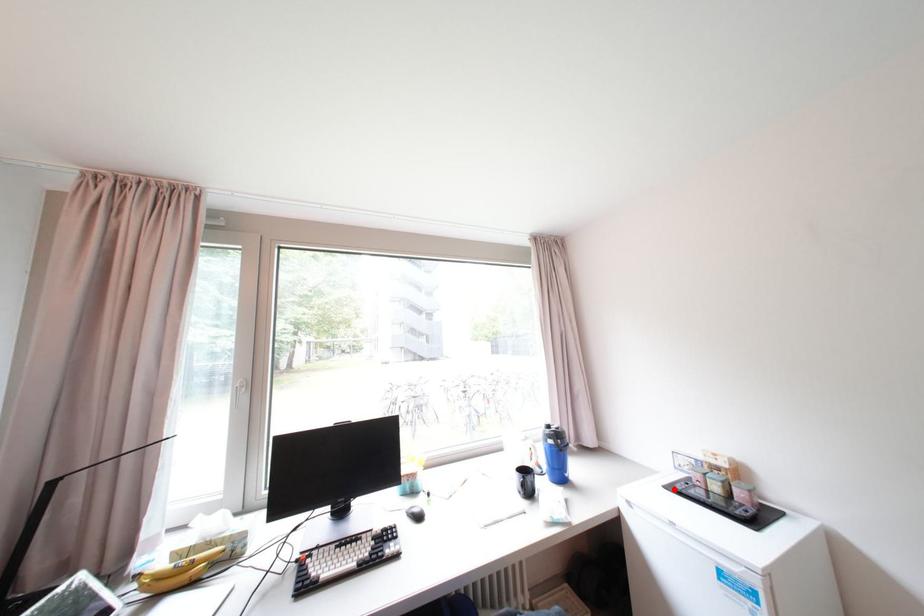
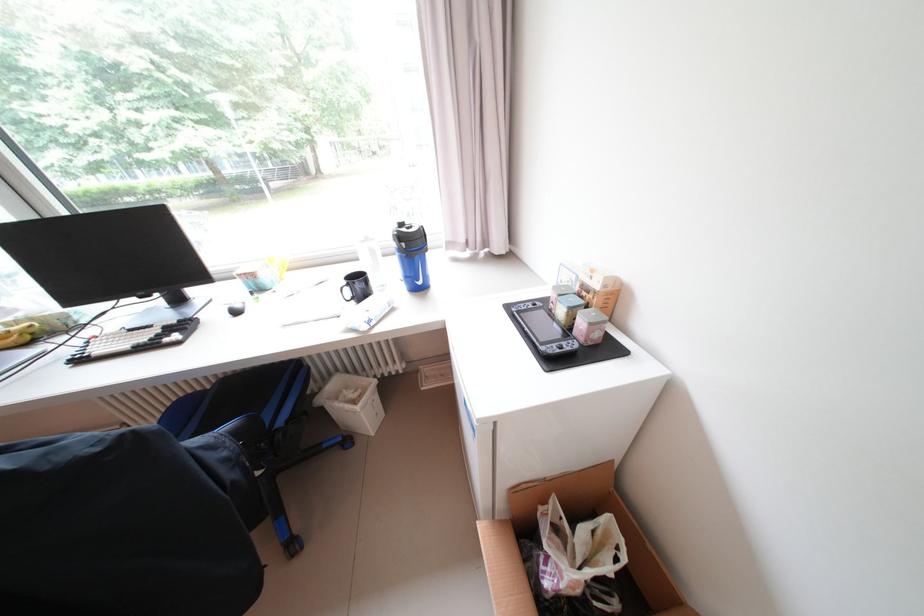
In the second image, find the point that corresponds to the highlighted location in the first image.

(516, 307)